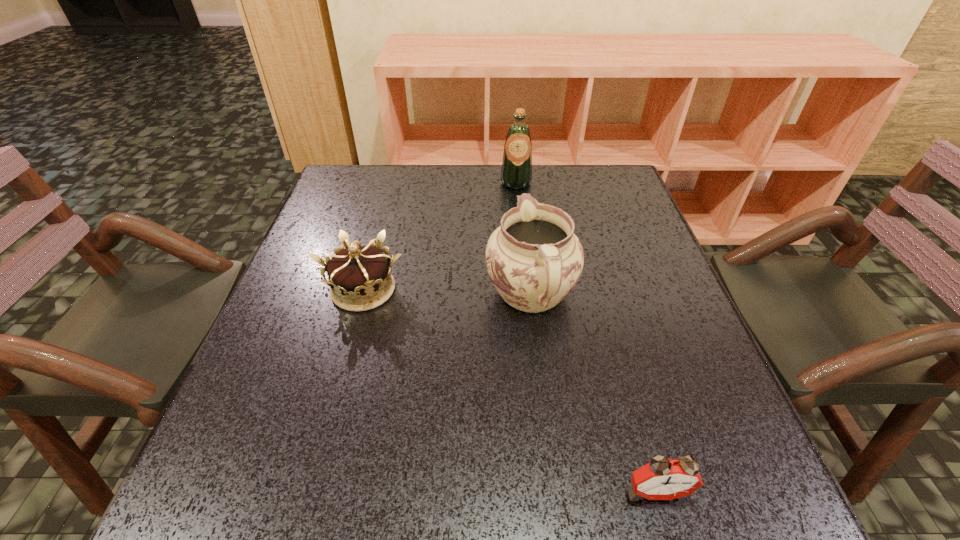
Where is `the farthest object`? the farthest object is located at coordinates (516, 173).

At what (x,y) coordinates should I click in order to perform the action: click on pitcher. Please return your answer as a coordinate pair (x, y). The image size is (960, 540). Looking at the image, I should click on (534, 259).

Identify the location of the leftmost object. (360, 279).

At what (x,y) coordinates should I click in order to perform the action: click on the nearest object. Please return your answer as a coordinate pair (x, y). This screenshot has width=960, height=540. Looking at the image, I should click on (662, 478).

Find the location of a particular element. the rightmost object is located at coordinates tap(662, 478).

Where is `vacant space situated 0.110m on the front-facing side of the farthest object`? vacant space situated 0.110m on the front-facing side of the farthest object is located at coordinates (519, 214).

The width and height of the screenshot is (960, 540). Identify the location of free space located on the spout of the pitcher. (518, 193).

Identify the location of vacant space situated 0.320m on the spout of the pitcher. (517, 186).

The height and width of the screenshot is (540, 960). What are the coordinates of `free space located 0.060m on the spout of the pitcher` in the screenshot? It's located at (524, 243).

You are a GUI agent. You are given a task and a screenshot of the screen. Output one action in this format:
    pyautogui.click(x=<x>, y=<y>)
    Task: Click on the free space located on the back of the crown
    The width and height of the screenshot is (960, 540).
    Given the screenshot: What is the action you would take?
    pyautogui.click(x=389, y=197)